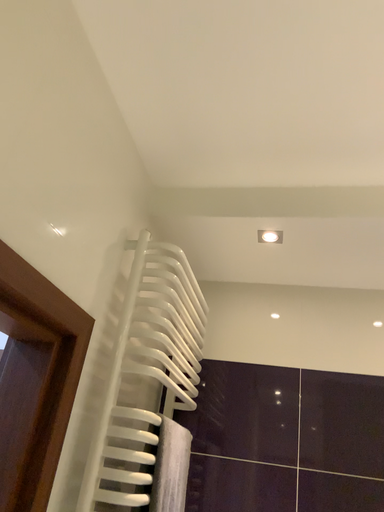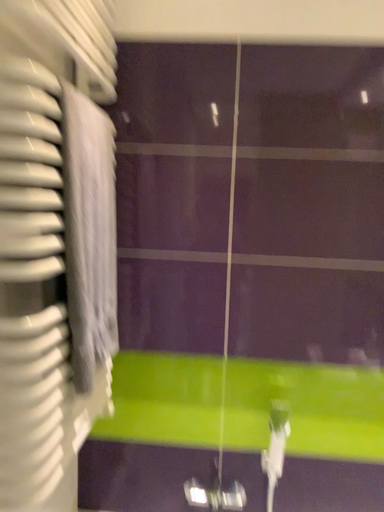
Question: How did the camera likely rotate when shooting the video?

Choices:
 (A) rotated downward
 (B) rotated upward

Answer: (A)